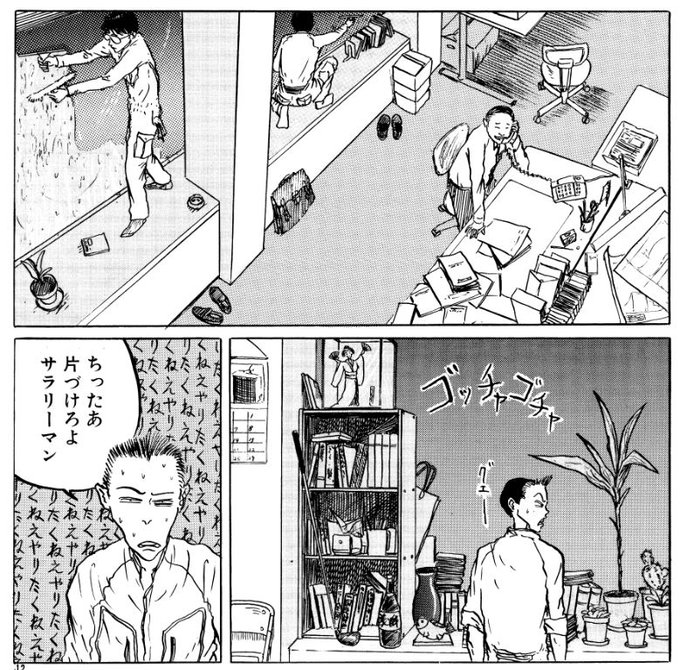
This screenshot has height=670, width=680. I want to click on chair wheel, so click(x=587, y=117), click(x=587, y=86), click(x=536, y=115), click(x=539, y=86).